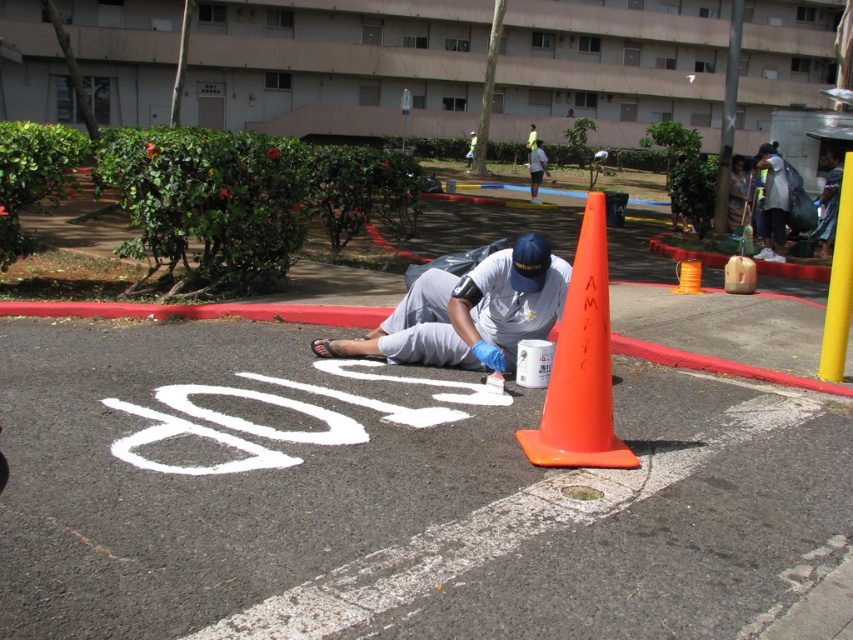
Can you confirm if white matte uniform at center is positioned below orange plastic traffic cone at center?

Incorrect, white matte uniform at center is not positioned below orange plastic traffic cone at center.

Which of these two, white matte uniform at center or orange plastic traffic cone at center, stands shorter?

orange plastic traffic cone at center is shorter.

This screenshot has height=640, width=853. Describe the element at coordinates (468, 312) in the screenshot. I see `white matte uniform at center` at that location.

I want to click on white matte uniform at center, so click(x=468, y=312).

Who is lower down, red rubber curb at lower center or white matte shirt at center?

Positioned lower is red rubber curb at lower center.

Does red rubber curb at lower center have a lesser height compared to white matte shirt at center?

Indeed, red rubber curb at lower center has a lesser height compared to white matte shirt at center.

Describe the element at coordinates (202, 310) in the screenshot. The height and width of the screenshot is (640, 853). I see `red rubber curb at lower center` at that location.

Locate an element on the screen. red rubber curb at lower center is located at coordinates (202, 310).

What do you see at coordinates (581, 364) in the screenshot? The width and height of the screenshot is (853, 640). I see `orange plastic traffic cone at center` at bounding box center [581, 364].

Is orange plastic traffic cone at center bigger than white matte shirt at center?

No.

Between point (590, 262) and point (535, 193), which one is positioned in front?

Point (590, 262) is more forward.

I want to click on orange plastic traffic cone at center, so click(581, 364).